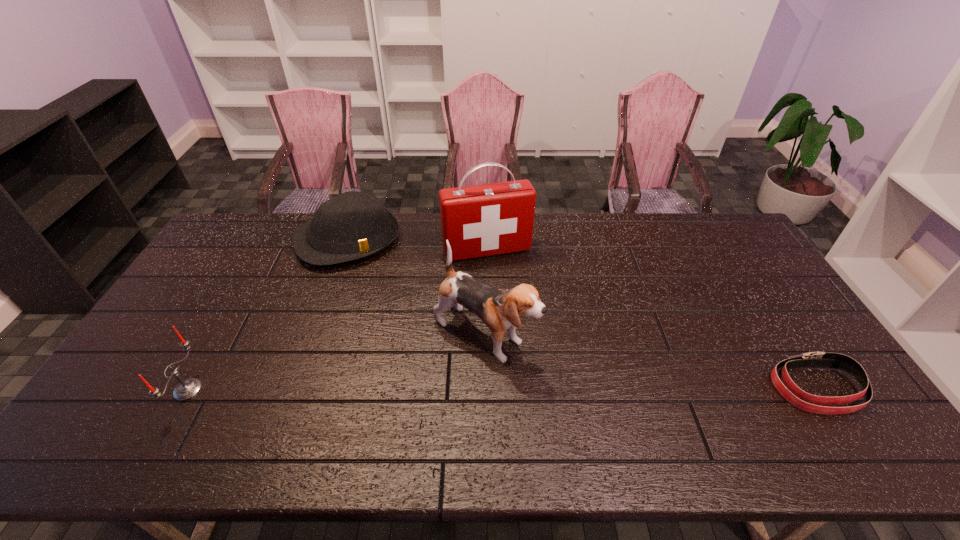
Find the location of a particular element. The width and height of the screenshot is (960, 540). free point located 0.080m on the front face of the first-aid kit is located at coordinates (503, 279).

The height and width of the screenshot is (540, 960). In order to click on vacant space located on the front face of the first-aid kit in this screenshot , I will do `click(525, 338)`.

Image resolution: width=960 pixels, height=540 pixels. Identify the location of free region located on the front face of the first-aid kit. (510, 296).

Find the location of a particular element. The height and width of the screenshot is (540, 960). vacant space located 0.200m on the front-facing side of the fourth object from right to left is located at coordinates (387, 306).

This screenshot has width=960, height=540. What are the coordinates of `free space located on the front-facing side of the fourth object from right to left` in the screenshot? It's located at (397, 325).

The width and height of the screenshot is (960, 540). Find the location of `free space located 0.060m on the front-facing side of the fourth object from right to left`. free space located 0.060m on the front-facing side of the fourth object from right to left is located at coordinates (372, 279).

The image size is (960, 540). I want to click on vacant position located at the face of the puppy, so click(x=576, y=383).

Identify the location of free space located at the face of the puppy. (597, 395).

Image resolution: width=960 pixels, height=540 pixels. Find the location of `vacant space located at the face of the puppy`. vacant space located at the face of the puppy is located at coordinates (560, 373).

Where is `the first-aid kit located in the far edge section of the desktop`? Image resolution: width=960 pixels, height=540 pixels. the first-aid kit located in the far edge section of the desktop is located at coordinates (483, 220).